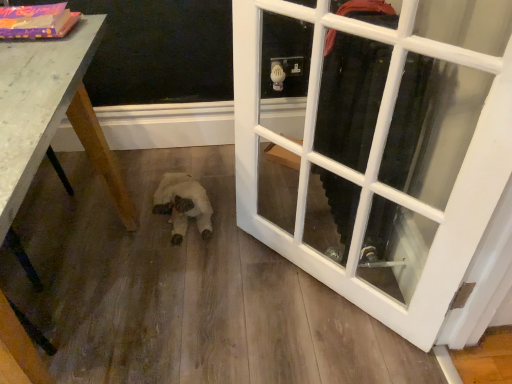
At what (x,y) coordinates should I click in order to perform the action: click on vacant area that lies to the right of white plush toy at center. Please return your answer as a coordinate pair (x, y). The image size is (512, 384). Looking at the image, I should click on (254, 205).